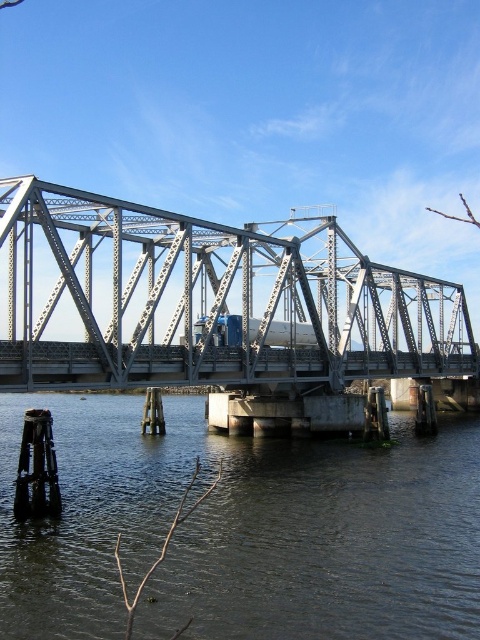
Question: Among these objects, which one is nearest to the camera?

Choices:
 (A) dark gray water at lower center
 (B) metallic gray bridge at center

Answer: (A)

Question: Which of the following is the farthest from the observer?

Choices:
 (A) dark gray water at lower center
 (B) metallic gray bridge at center

Answer: (B)

Question: Is dark gray water at lower center positioned before metallic gray bridge at center?

Choices:
 (A) no
 (B) yes

Answer: (B)

Question: Does dark gray water at lower center appear on the right side of metallic gray bridge at center?

Choices:
 (A) no
 (B) yes

Answer: (A)

Question: Which of the following is the closest to the observer?

Choices:
 (A) (194, 445)
 (B) (136, 372)

Answer: (B)

Question: From the image, what is the correct spatial relationship of dark gray water at lower center in relation to metallic gray bridge at center?

Choices:
 (A) right
 (B) left

Answer: (B)